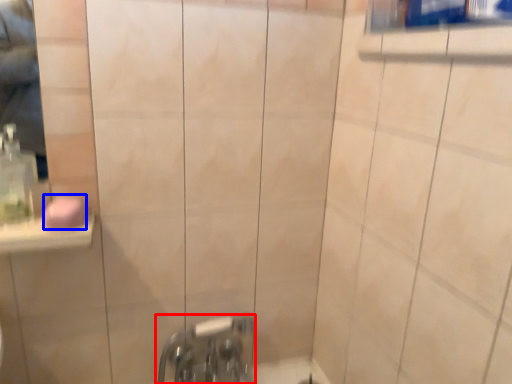
Question: Which of the following is the farthest to the observer, tap (highlighted by a red box) or soap (highlighted by a blue box)?

Choices:
 (A) tap
 (B) soap

Answer: (A)